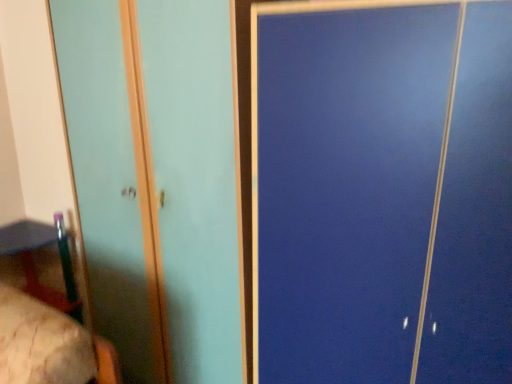
Question: Is wooden table at lower left inside or outside of wooden bed at lower left?

Choices:
 (A) outside
 (B) inside

Answer: (A)

Question: From the image's perspective, is wooden table at lower left located above or below wooden bed at lower left?

Choices:
 (A) below
 (B) above

Answer: (B)

Question: Considering the real-world distances, which object is closest to the wooden table at lower left?

Choices:
 (A) wooden bed at lower left
 (B) matte teal screen door at left

Answer: (B)

Question: Which object is positioned closest to the wooden table at lower left?

Choices:
 (A) wooden bed at lower left
 (B) matte teal screen door at left

Answer: (B)